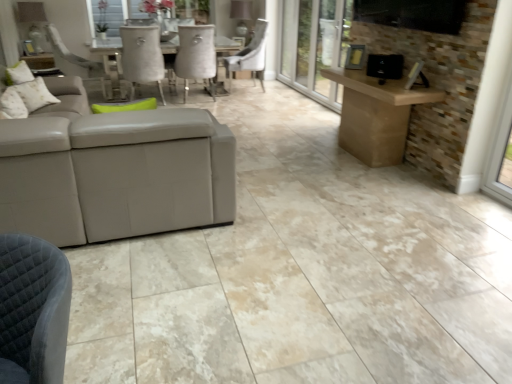
Question: From a real-world perspective, is suede-like beige chair at center, which is the first chair from left to right, physically located above or below fluffy white pillow at upper left, acting as the 1th pillow starting from the front?

Choices:
 (A) above
 (B) below

Answer: (B)

Question: From their relative heights in the image, would you say suede-like beige chair at center, which is the first chair from left to right, is taller or shorter than fluffy white pillow at upper left, acting as the 1th pillow starting from the front?

Choices:
 (A) short
 (B) tall

Answer: (B)

Question: Which object is positioned farthest from the transparent glass screen door at center?

Choices:
 (A) fluffy white pillow at upper left, the second pillow when ordered from left to right
 (B) white fabric pillow at upper left, which is the 2th pillow from right to left
 (C) suede-like beige chair at center, which is the first chair from left to right
 (D) white leather chair at center, which is the 2th chair in left-to-right order

Answer: (A)

Question: Estimate the real-world distances between objects in this image. Which object is farther from the fluffy white pillow at upper left, the second pillow when ordered from left to right?

Choices:
 (A) transparent glass screen door at center
 (B) white fabric pillow at upper left, acting as the 1th pillow starting from the left
 (C) white leather chair at center, which is the 2th chair in left-to-right order
 (D) suede-like beige chair at center, the second chair when ordered from right to left

Answer: (C)